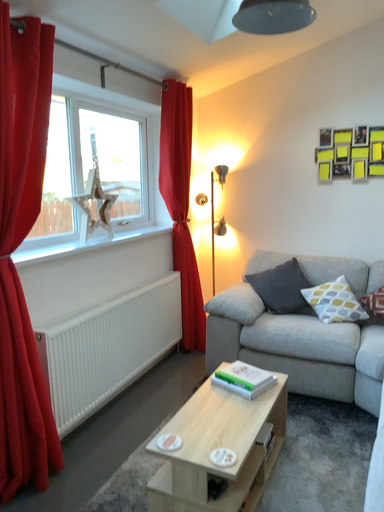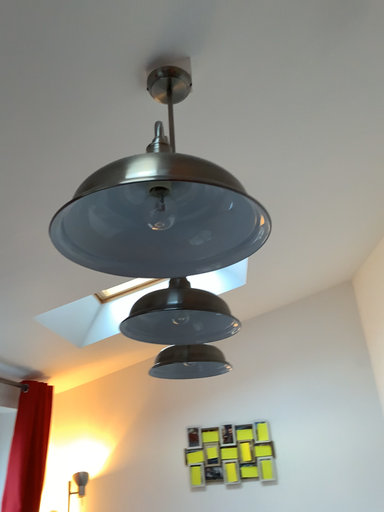
Question: Which way did the camera rotate in the video?

Choices:
 (A) rotated downward
 (B) rotated upward

Answer: (B)